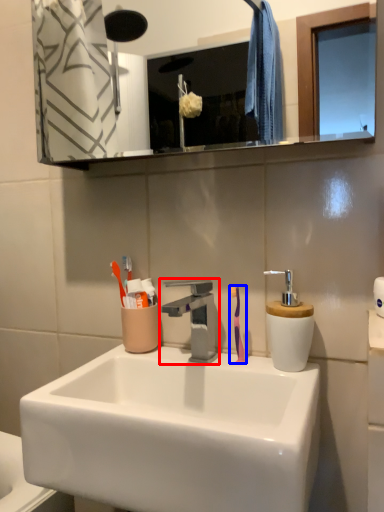
Question: Among these objects, which one is farthest to the camera, tap (highlighted by a red box) or toothbrush (highlighted by a blue box)?

Choices:
 (A) tap
 (B) toothbrush

Answer: (B)